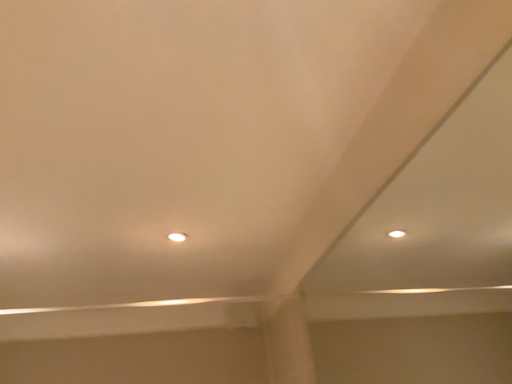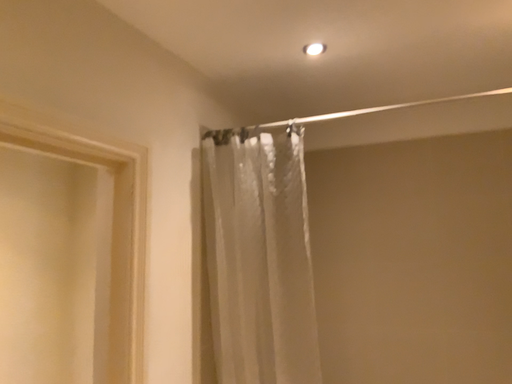
Question: How did the camera likely rotate when shooting the video?

Choices:
 (A) rotated right
 (B) rotated left

Answer: (B)